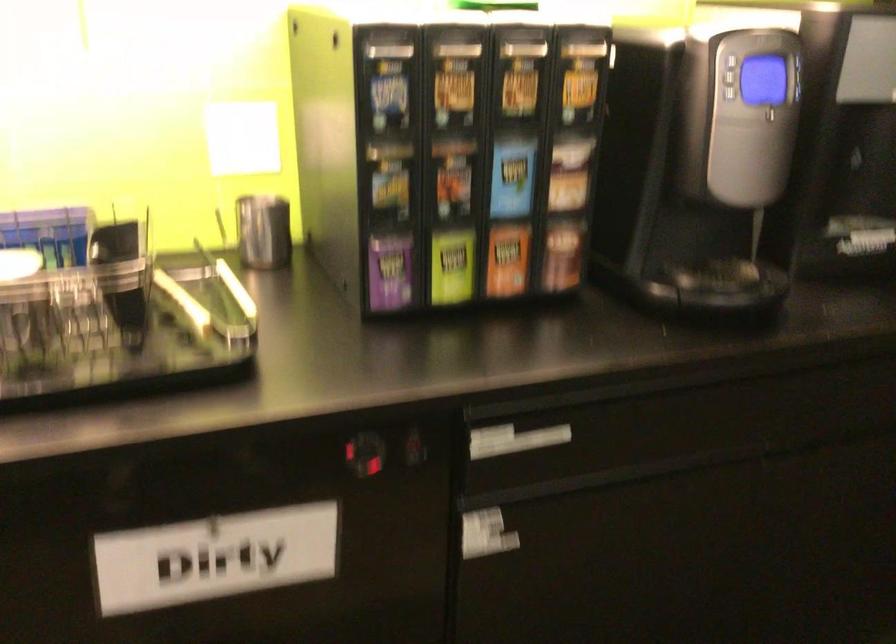
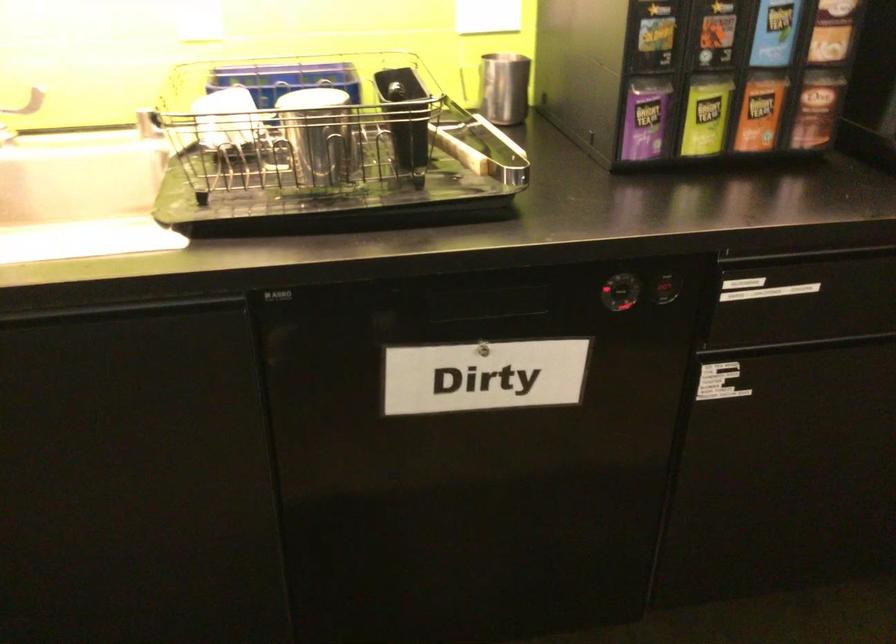
In a continuous first-person perspective shot, in which direction is the camera moving?

The movement direction of the cameraman is left, backward.